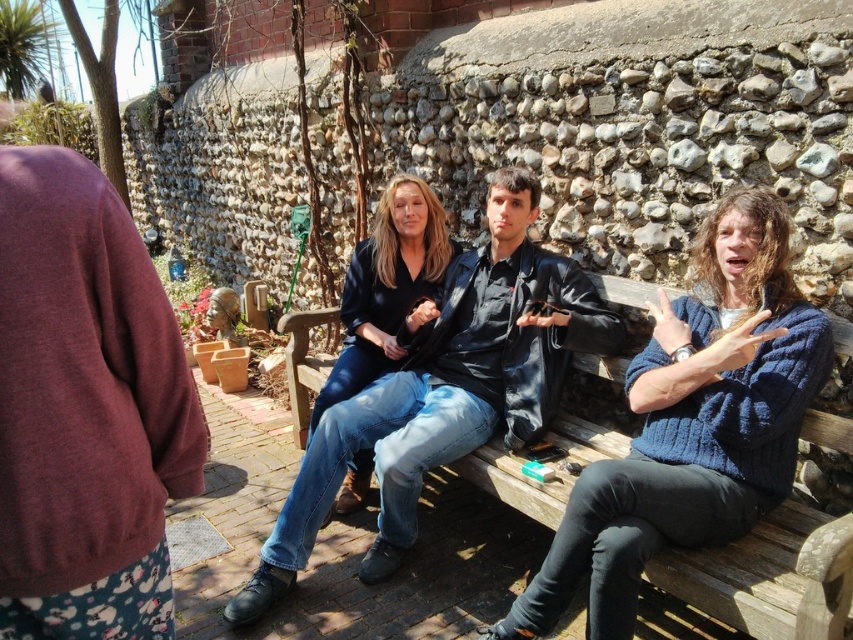
Question: Is knitted blue sweater at center to the left of matte black shirt at center from the viewer's perspective?

Choices:
 (A) yes
 (B) no

Answer: (B)

Question: In this image, where is knitted blue sweater at center located relative to denim jeans at center?

Choices:
 (A) right
 (B) left

Answer: (A)

Question: Which of these objects is positioned closest to the knitted blue sweater at center?

Choices:
 (A) denim jeans at center
 (B) matte black shirt at center

Answer: (A)

Question: Does knitted blue sweater at center appear over matte black shirt at center?

Choices:
 (A) no
 (B) yes

Answer: (A)

Question: Which object is positioned closest to the matte black shirt at center?

Choices:
 (A) denim jeans at center
 (B) knitted blue sweater at center

Answer: (A)

Question: Estimate the real-world distances between objects in this image. Which object is farther from the knitted blue sweater at center?

Choices:
 (A) matte black shirt at center
 (B) denim jeans at center

Answer: (A)